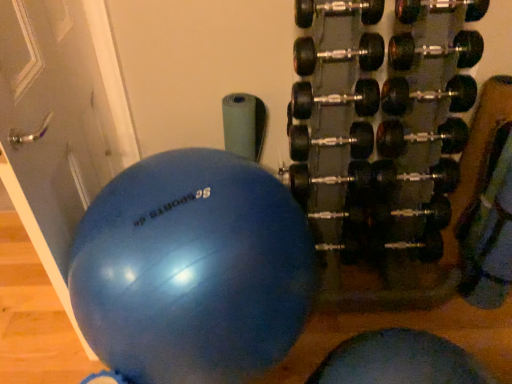
Measure the distance between black rubber dumbbell at right and camera.

black rubber dumbbell at right and camera are 3.95 feet apart.

Image resolution: width=512 pixels, height=384 pixels. I want to click on black rubber dumbbell at right, so click(x=381, y=142).

In the scene shown: Measure the distance between blue rubber ball at center and camera.

blue rubber ball at center is 93.90 centimeters from camera.

What is the approximate width of matte gray door at left?

5.31 inches.

Where is `black rubber dumbbell at right`? black rubber dumbbell at right is located at coordinates (381, 142).

Considering the positions of points (99, 271) and (324, 206), is point (99, 271) farther from camera compared to point (324, 206)?

No, it is in front of (324, 206).

Is blue rubber ball at center facing away from black rubber dumbbell at right?

No, blue rubber ball at center's orientation is not away from black rubber dumbbell at right.

Is blue rubber ball at center directly adjacent to black rubber dumbbell at right?

There is a gap between blue rubber ball at center and black rubber dumbbell at right.

Is blue rubber ball at center not within black rubber dumbbell at right?

blue rubber ball at center lies outside black rubber dumbbell at right's area.

Where is `ball below the matte gray door at left (from a real-world perspective)`? ball below the matte gray door at left (from a real-world perspective) is located at coordinates (192, 270).

From a real-world perspective, is blue rubber ball at center located higher than matte gray door at left?

No, from a real-world perspective, blue rubber ball at center is not on top of matte gray door at left.

Is point (126, 340) closer or farther from the camera than point (77, 204)?

Clearly, point (126, 340) is closer to the camera than point (77, 204).

From the image's perspective, which is above, blue rubber ball at center or matte gray door at left?

matte gray door at left, from the image's perspective.

Consider the image. Considering the positions of objects matte gray door at left and black rubber dumbbell at right in the image provided, who is more to the right, matte gray door at left or black rubber dumbbell at right?

black rubber dumbbell at right.

Considering the sizes of objects matte gray door at left and black rubber dumbbell at right in the image provided, who is bigger, matte gray door at left or black rubber dumbbell at right?

black rubber dumbbell at right.

From a real-world perspective, is matte gray door at left over black rubber dumbbell at right?

Yes, from a real-world perspective, matte gray door at left is over black rubber dumbbell at right

In terms of height, does matte gray door at left look taller or shorter compared to black rubber dumbbell at right?

Considering their sizes, matte gray door at left has more height than black rubber dumbbell at right.

Is matte gray door at left positioned behind blue rubber ball at center?

No, it is in front of blue rubber ball at center.

Would you say matte gray door at left contains blue rubber ball at center?

No, blue rubber ball at center is not a part of matte gray door at left.

Which object is thinner, matte gray door at left or blue rubber ball at center?

Thinner between the two is matte gray door at left.

Identify the location of dumbbell below the matte gray door at left (from a real-world perspective). (381, 142).

Which is less distant, [349,254] or [59,100]?

Clearly, point [349,254] is more distant from the camera than point [59,100].

How different are the orientations of black rubber dumbbell at right and matte gray door at left in degrees?

87.7 degrees separate the facing orientations of black rubber dumbbell at right and matte gray door at left.

Would you say black rubber dumbbell at right is a long distance from matte gray door at left?

black rubber dumbbell at right is near matte gray door at left, not far away.

Identify the location of dumbbell above the blue rubber ball at center (from the image's perspective). This screenshot has width=512, height=384. pos(381,142).

Does black rubber dumbbell at right have a smaller size compared to blue rubber ball at center?

Actually, black rubber dumbbell at right might be larger than blue rubber ball at center.

Is black rubber dumbbell at right shorter than blue rubber ball at center?

No.

Is black rubber dumbbell at right beside blue rubber ball at center?

No, black rubber dumbbell at right is not touching blue rubber ball at center.

Identify the location of ball located below the black rubber dumbbell at right (from the image's perspective). Image resolution: width=512 pixels, height=384 pixels. (192, 270).

Where is `door above the blue rubber ball at center (from the image's perspective)`? door above the blue rubber ball at center (from the image's perspective) is located at coordinates (60, 121).

Looking at the image, which one is located further to black rubber dumbbell at right, blue rubber ball at center or matte gray door at left?

matte gray door at left is positioned further to the anchor black rubber dumbbell at right.

Considering their positions, is black rubber dumbbell at right positioned closer to blue rubber ball at center than matte gray door at left?

matte gray door at left.

Based on their spatial positions, is matte gray door at left or blue rubber ball at center further from black rubber dumbbell at right?

matte gray door at left lies further to black rubber dumbbell at right than the other object.

Considering their positions, is black rubber dumbbell at right positioned closer to matte gray door at left than blue rubber ball at center?

blue rubber ball at center lies closer to matte gray door at left than the other object.

Looking at the image, which one is located further to blue rubber ball at center, matte gray door at left or black rubber dumbbell at right?

Based on the image, black rubber dumbbell at right appears to be further to blue rubber ball at center.

Looking at the image, which one is located further to matte gray door at left, blue rubber ball at center or black rubber dumbbell at right?

black rubber dumbbell at right is further to matte gray door at left.

At what (x,y) coordinates should I click in order to perform the action: click on ball between matte gray door at left and black rubber dumbbell at right. Please return your answer as a coordinate pair (x, y). The height and width of the screenshot is (384, 512). Looking at the image, I should click on (192, 270).